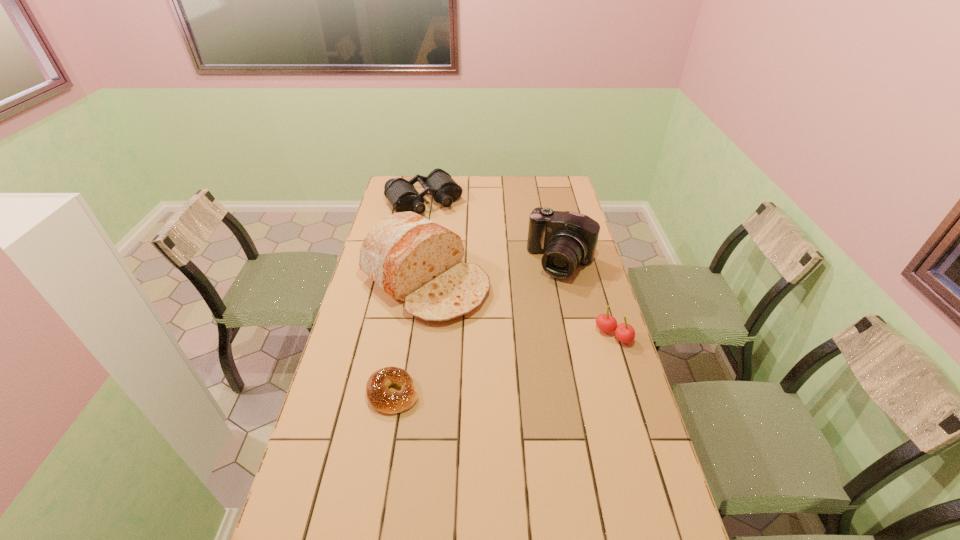
Find the location of a particular element. vacant area that lies between the cherry and the camera is located at coordinates pyautogui.click(x=588, y=299).

At what (x,y) coordinates should I click in order to perform the action: click on empty space that is in between the second tallest object and the shortest object. Please return your answer as a coordinate pair (x, y). Looking at the image, I should click on [x=477, y=327].

Locate an element on the screen. The height and width of the screenshot is (540, 960). free spot between the nearest object and the camera is located at coordinates (477, 327).

At what (x,y) coordinates should I click in order to perform the action: click on vacant area that lies between the camera and the nearest object. Please return your answer as a coordinate pair (x, y). The height and width of the screenshot is (540, 960). Looking at the image, I should click on (477, 327).

Where is `vacant region between the cherry and the binoculars`? The image size is (960, 540). vacant region between the cherry and the binoculars is located at coordinates (518, 268).

Where is `free space between the farthest object and the second tallest object`? Image resolution: width=960 pixels, height=540 pixels. free space between the farthest object and the second tallest object is located at coordinates point(492,231).

Find the location of a particular element. object that is the nearest to the farthest object is located at coordinates (414, 260).

Choose which object is the fourth nearest neighbor to the bread. Please provide its 2D coordinates. Your answer should be formatted as a tuple, i.e. [(x, y)], where the tuple contains the x and y coordinates of a point satisfying the conditions above.

[(625, 333)]

Where is `vacant area in the image that satisfies the following two spatial constraints: 1. on the front side of the shortest object; 2. on the left side of the binoculars`? The width and height of the screenshot is (960, 540). vacant area in the image that satisfies the following two spatial constraints: 1. on the front side of the shortest object; 2. on the left side of the binoculars is located at coordinates (389, 393).

At what (x,y) coordinates should I click in order to perform the action: click on free region that satisfies the following two spatial constraints: 1. on the front side of the binoculars; 2. on the right side of the bagel. Please return your answer as a coordinate pair (x, y). This screenshot has height=540, width=960. Looking at the image, I should click on (389, 393).